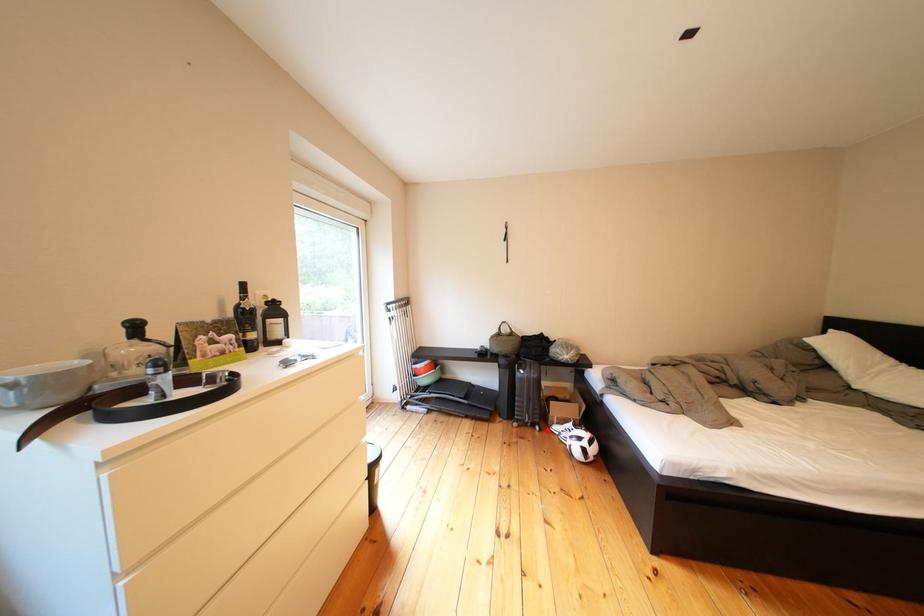
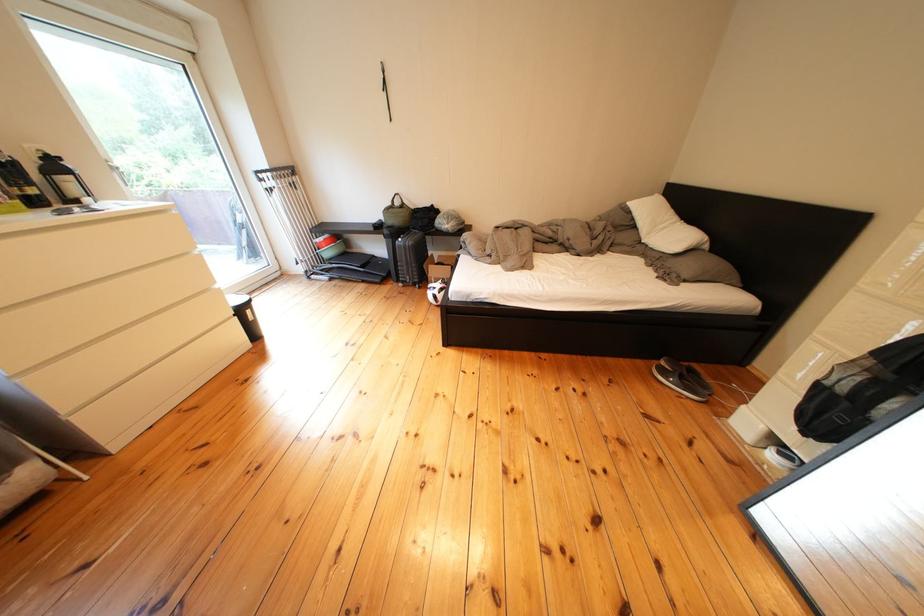
Question: A red point is marked in image1. In image2, is the corresponding 3D point closer to the camera or farther? Reply with the corresponding letter.

Choices:
 (A) The corresponding 3D point is closer.
 (B) The corresponding 3D point is farther.

Answer: (A)